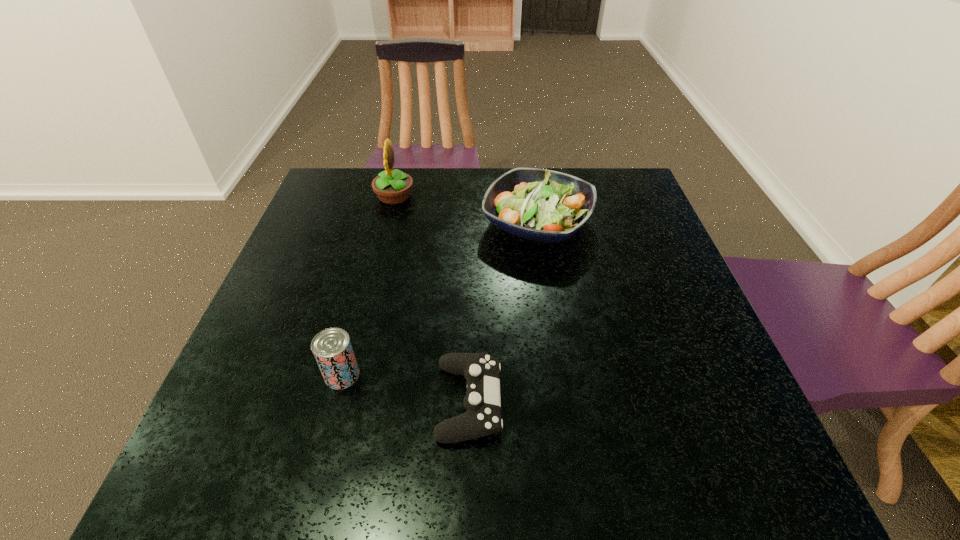
Image resolution: width=960 pixels, height=540 pixels. Identify the location of object situated at the near edge. (482, 400).

In the image, there is a desktop. Identify the location of blank space at the far edge. The width and height of the screenshot is (960, 540). (453, 212).

Image resolution: width=960 pixels, height=540 pixels. I want to click on vacant space at the near edge of the desktop, so click(x=598, y=458).

What are the coordinates of `vacant space at the left edge of the desktop` in the screenshot? It's located at (304, 327).

This screenshot has height=540, width=960. What are the coordinates of `vacant space at the right edge` in the screenshot? It's located at (686, 312).

The image size is (960, 540). In the image, there is a desktop. In order to click on free space at the far left corner in this screenshot , I will do `click(356, 187)`.

This screenshot has height=540, width=960. Find the location of `vacant space at the far right corner of the desktop`. vacant space at the far right corner of the desktop is located at coordinates (633, 192).

Find the location of `free space between the salad plate and the control`. free space between the salad plate and the control is located at coordinates (503, 312).

Find the location of a particular element. This screenshot has width=960, height=540. free spot between the shortest object and the sunflower is located at coordinates (432, 299).

Locate an element on the screen. The width and height of the screenshot is (960, 540). vacant space in between the tallest object and the beer can is located at coordinates (369, 286).